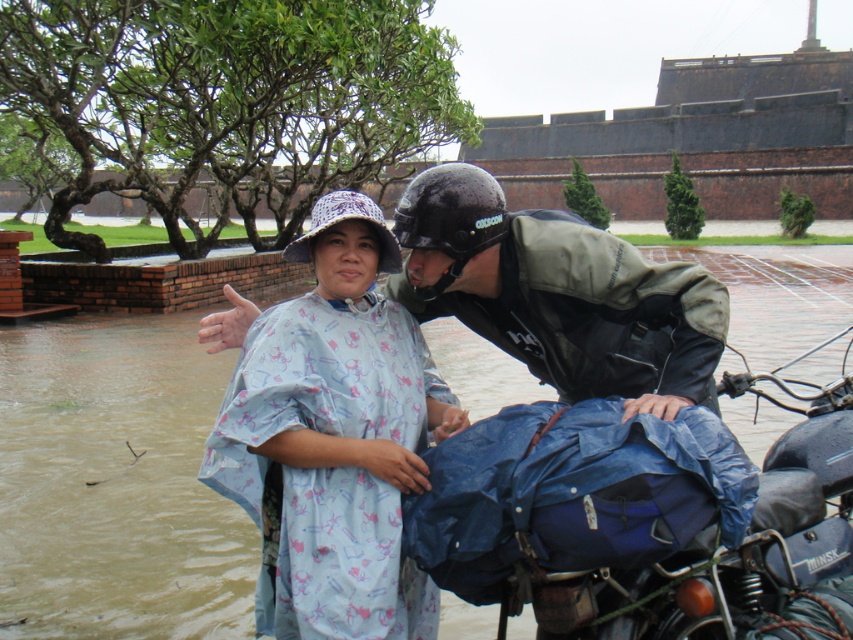
You are a delivery person who needs to find the blue printed raincoat at center in the image. According to the scene description, where exactly is it located?

The blue printed raincoat at center is located at the 2D coordinates point (331, 435).